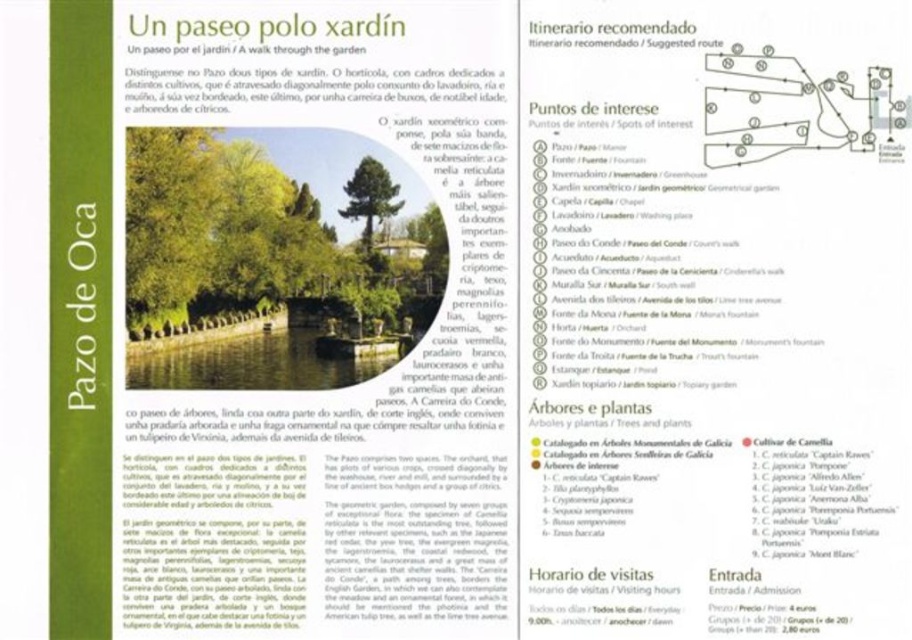
Question: Among these objects, which one is farthest from the camera?

Choices:
 (A) green paper at upper center
 (B) white paper at upper center

Answer: (A)

Question: Which object appears farthest from the camera in this image?

Choices:
 (A) green paper at upper center
 (B) white paper at upper center

Answer: (A)

Question: In this image, where is green paper at upper center located relative to white paper at upper center?

Choices:
 (A) below
 (B) above

Answer: (A)

Question: Does green paper at upper center have a smaller size compared to white paper at upper center?

Choices:
 (A) yes
 (B) no

Answer: (A)

Question: Does green paper at upper center appear over white paper at upper center?

Choices:
 (A) no
 (B) yes

Answer: (A)